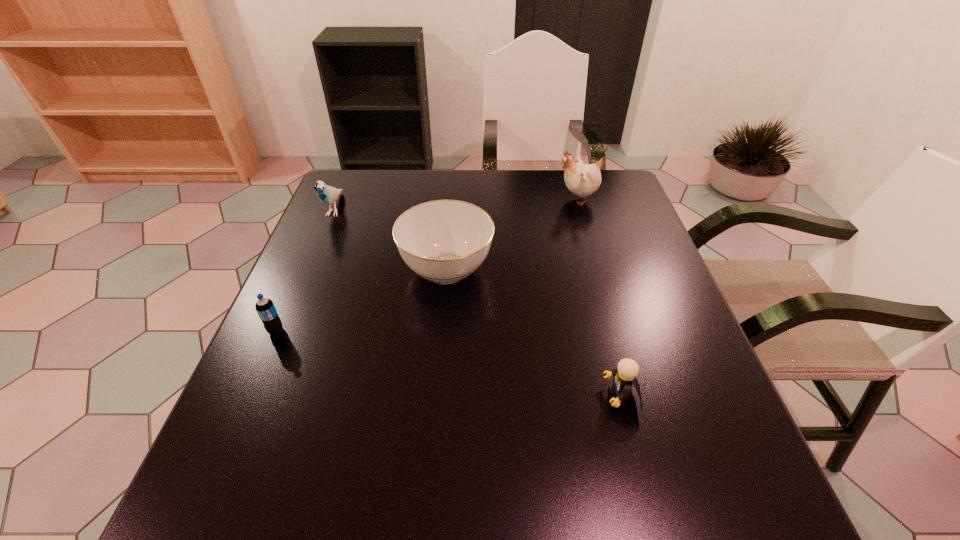
This screenshot has width=960, height=540. Identify the location of the right bird. (581, 179).

Locate an element on the screen. The width and height of the screenshot is (960, 540). the shorter bird is located at coordinates (327, 194).

This screenshot has width=960, height=540. Identify the location of the third farthest object. (444, 241).

This screenshot has height=540, width=960. What are the coordinates of `the third object from left to right` in the screenshot? It's located at (444, 241).

This screenshot has width=960, height=540. Identify the location of soda bottle. (265, 308).

Image resolution: width=960 pixels, height=540 pixels. I want to click on the nearest object, so (x=625, y=375).

The width and height of the screenshot is (960, 540). Find the location of `vacant space located 0.050m at the beak of the right bird`. vacant space located 0.050m at the beak of the right bird is located at coordinates point(539,199).

The image size is (960, 540). I want to click on free point located 0.210m at the beak of the right bird, so click(x=484, y=199).

Find the location of a particular element. Image resolution: width=960 pixels, height=540 pixels. vacant point located at the beak of the right bird is located at coordinates (494, 199).

The width and height of the screenshot is (960, 540). Identify the location of vacant area situated 0.250m at the face of the left bird. (300, 294).